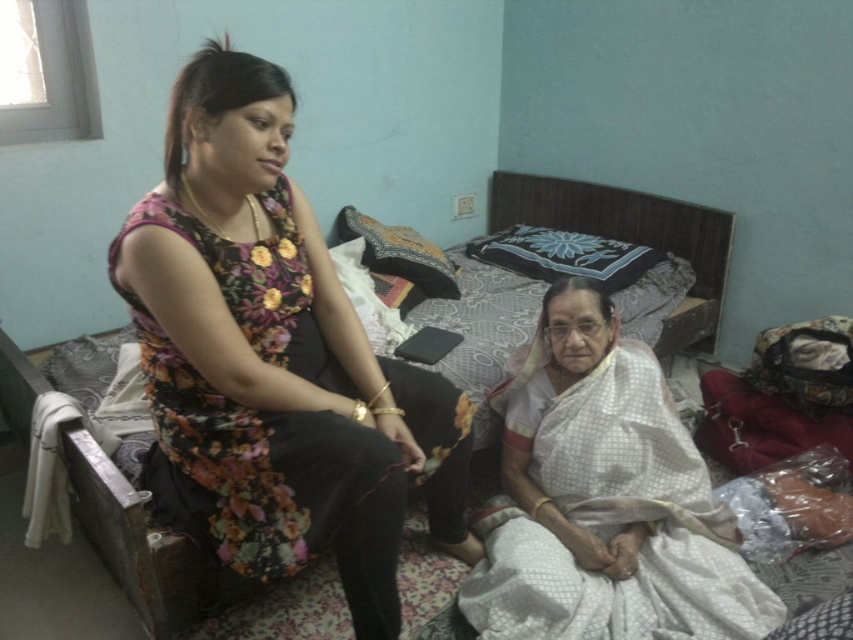
In the scene shown: Who is positioned more to the right, floral fabric dress at left or white silk saree at lower right?

From the viewer's perspective, white silk saree at lower right appears more on the right side.

Does floral fabric dress at left appear on the right side of white silk saree at lower right?

No, floral fabric dress at left is not to the right of white silk saree at lower right.

Where is `floral fabric dress at left`? The height and width of the screenshot is (640, 853). floral fabric dress at left is located at coordinates (274, 360).

Looking at this image, is floral fabric dress at left wider than patterned fabric bed at center?

→ No.

In the scene shown: Which is more to the right, floral fabric dress at left or patterned fabric bed at center?

Positioned to the right is patterned fabric bed at center.

Is point (154, 216) more distant than point (544, 202)?

No, (154, 216) is in front of (544, 202).

At what (x,y) coordinates should I click in order to perform the action: click on floral fabric dress at left. Please return your answer as a coordinate pair (x, y). Image resolution: width=853 pixels, height=640 pixels. Looking at the image, I should click on (274, 360).

Does white silk saree at lower right come in front of patterned fabric bed at center?

Yes, it is.

Is white silk saree at lower right above patterned fabric bed at center?

Incorrect, white silk saree at lower right is not positioned above patterned fabric bed at center.

Who is more forward, (573, 438) or (192, 592)?

Point (192, 592) is more forward.

The height and width of the screenshot is (640, 853). I want to click on white silk saree at lower right, so point(604,500).